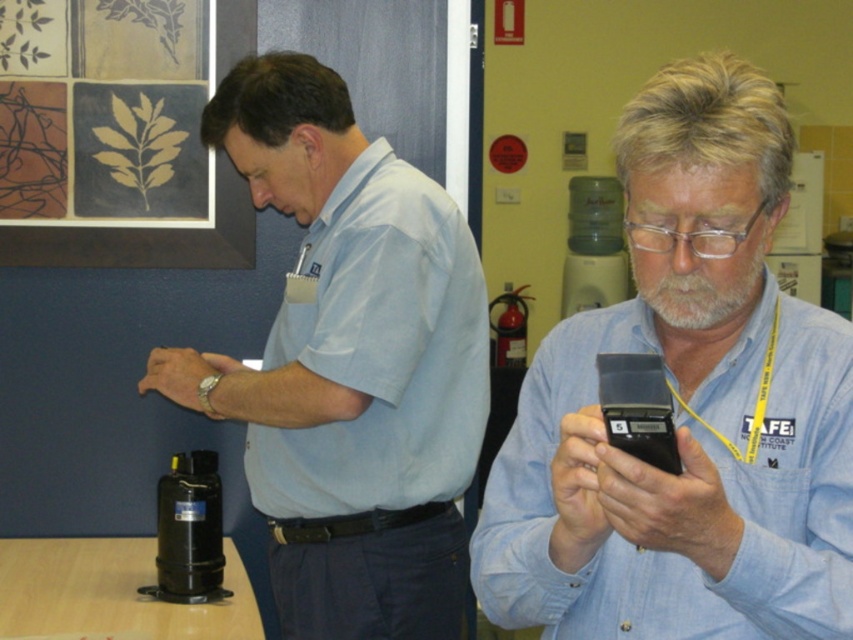
Question: Which object is closer to the camera taking this photo?

Choices:
 (A) blue denim shirt at center
 (B) light blue shirt at center

Answer: (A)

Question: Which point is farther from the camera taking this photo?

Choices:
 (A) (646, 438)
 (B) (312, 266)
 (C) (764, 170)
 (D) (364, 204)

Answer: (B)

Question: Can you confirm if light blue cotton shirt at center is positioned to the left of black plastic smartphone at center?

Choices:
 (A) no
 (B) yes

Answer: (B)

Question: Is light blue shirt at center positioned in front of black plastic smartphone at center?

Choices:
 (A) no
 (B) yes

Answer: (A)

Question: Which object is the farthest from the light blue shirt at center?

Choices:
 (A) black plastic smartphone at center
 (B) blue denim shirt at center
 (C) light blue cotton shirt at center

Answer: (A)

Question: Can you confirm if blue denim shirt at center is wider than black plastic smartphone at center?

Choices:
 (A) yes
 (B) no

Answer: (A)